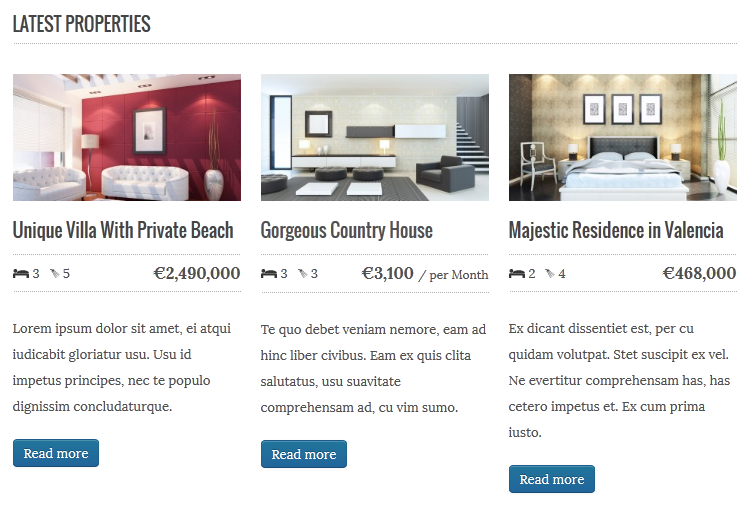
The image size is (754, 520). I want to click on number of bathrooms, so (x=59, y=273), (x=302, y=264), (x=550, y=267).